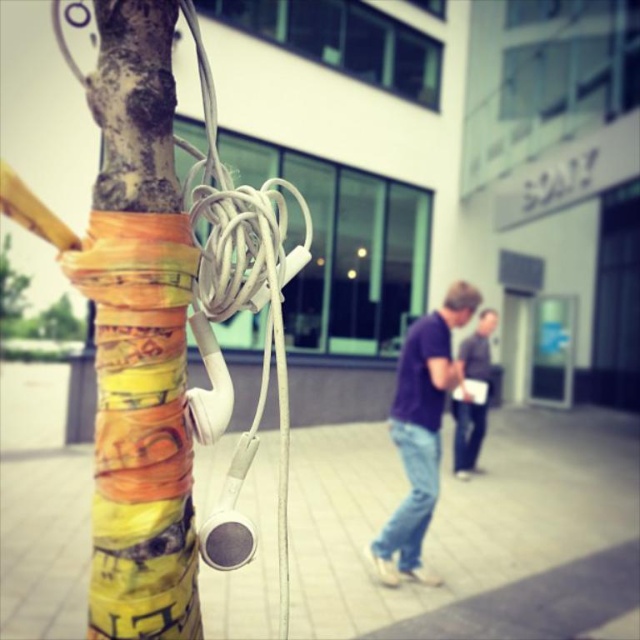
What do you see at coordinates (420, 432) in the screenshot? I see `purple matte shirt at center` at bounding box center [420, 432].

Is point (403, 528) behind point (472, 426)?

That is False.

In order to click on purple matte shirt at center in this screenshot , I will do `click(420, 432)`.

Find the location of a particular element. The width and height of the screenshot is (640, 640). purple matte shirt at center is located at coordinates (420, 432).

Is multicolored paper at center to the right of purple matte shirt at center from the viewer's perspective?

No, multicolored paper at center is not to the right of purple matte shirt at center.

Describe the element at coordinates (140, 339) in the screenshot. I see `multicolored paper at center` at that location.

The width and height of the screenshot is (640, 640). What are the coordinates of `multicolored paper at center` in the screenshot? It's located at (140, 339).

Who is lower down, white matte pavement at lower center or denim jeans at center?

Positioned lower is white matte pavement at lower center.

Is point (376, 449) positioned in front of point (481, 356)?

Yes, point (376, 449) is closer to viewer.

Where is `white matte pavement at lower center`? white matte pavement at lower center is located at coordinates (474, 531).